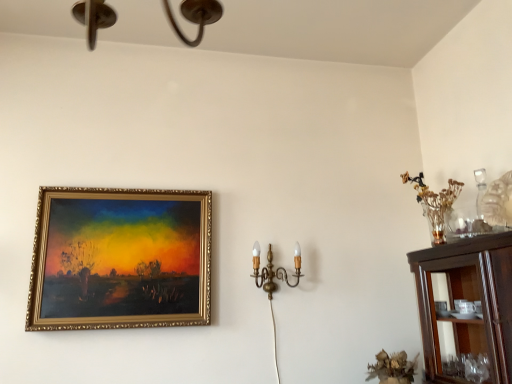
Question: Can you confirm if gold ornate frame at upper left is wider than dark wood cabinet at right?

Choices:
 (A) yes
 (B) no

Answer: (B)

Question: Is gold ornate frame at upper left to the left of dark wood cabinet at right from the viewer's perspective?

Choices:
 (A) no
 (B) yes

Answer: (B)

Question: Is gold ornate frame at upper left not within dark wood cabinet at right?

Choices:
 (A) no
 (B) yes

Answer: (B)

Question: From the image's perspective, is gold ornate frame at upper left on dark wood cabinet at right?

Choices:
 (A) no
 (B) yes

Answer: (B)

Question: Is gold ornate frame at upper left positioned far away from dark wood cabinet at right?

Choices:
 (A) yes
 (B) no

Answer: (A)

Question: From their relative heights in the image, would you say dark wood cabinet at right is taller or shorter than gold brass wall sconce at center right?

Choices:
 (A) short
 (B) tall

Answer: (B)

Question: From the image's perspective, relative to gold brass wall sconce at center right, is dark wood cabinet at right above or below?

Choices:
 (A) below
 (B) above

Answer: (A)

Question: Considering the positions of point (452, 281) and point (283, 271), is point (452, 281) closer or farther from the camera than point (283, 271)?

Choices:
 (A) farther
 (B) closer

Answer: (B)

Question: Is dark wood cabinet at right wider or thinner than gold brass wall sconce at center right?

Choices:
 (A) wide
 (B) thin

Answer: (A)

Question: Is gold ornate frame at upper left in front of or behind dark wood cabinet at right in the image?

Choices:
 (A) behind
 (B) front

Answer: (A)

Question: Is gold ornate frame at upper left to the left or to the right of dark wood cabinet at right in the image?

Choices:
 (A) left
 (B) right

Answer: (A)

Question: Is point (46, 256) positioned closer to the camera than point (468, 379)?

Choices:
 (A) closer
 (B) farther

Answer: (B)

Question: Is gold ornate frame at upper left taller or shorter than dark wood cabinet at right?

Choices:
 (A) tall
 (B) short

Answer: (A)

Question: Considering the positions of gold ornate frame at upper left and gold brass wall sconce at center right in the image, is gold ornate frame at upper left bigger or smaller than gold brass wall sconce at center right?

Choices:
 (A) small
 (B) big

Answer: (B)

Question: Does point (120, 291) appear closer or farther from the camera than point (269, 274)?

Choices:
 (A) closer
 (B) farther

Answer: (A)